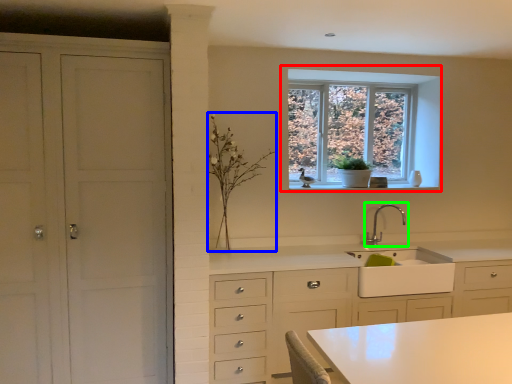
Question: Which object is the farthest from window (highlighted by a red box)? Choose among these: plant (highlighted by a blue box) or tap (highlighted by a green box).

Choices:
 (A) plant
 (B) tap

Answer: (A)